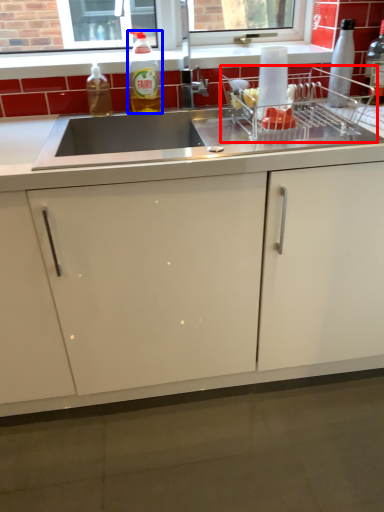
Question: Which point is closer to the camera, appliance (highlighted by a red box) or bottle (highlighted by a blue box)?

Choices:
 (A) appliance
 (B) bottle

Answer: (A)